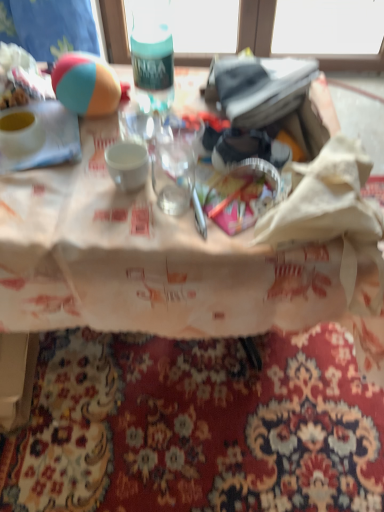
Where is `free area in between matte white bowl at upper left and tri-color rubber ball at upper left`? The width and height of the screenshot is (384, 512). free area in between matte white bowl at upper left and tri-color rubber ball at upper left is located at coordinates (75, 133).